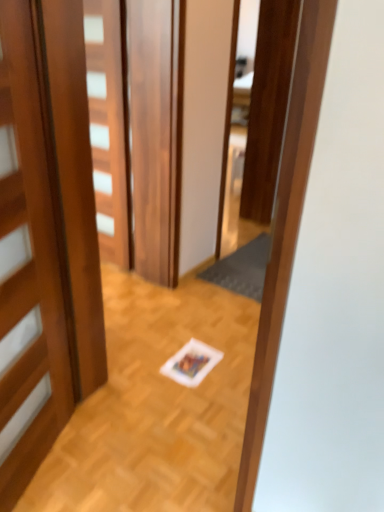
Question: Could wooden door at center, which appears as the first door when viewed from the back, be considered to be inside wooden door at left, which is counted as the 2th door, starting from the back?

Choices:
 (A) yes
 (B) no

Answer: (B)

Question: Is wooden door at left, arranged as the 1th door when viewed from the front, shorter than wooden door at center, which appears as the first door when viewed from the back?

Choices:
 (A) yes
 (B) no

Answer: (A)

Question: Is wooden door at left, arranged as the 1th door when viewed from the front, next to wooden door at center, which is counted as the 2th door, starting from the front, and touching it?

Choices:
 (A) yes
 (B) no

Answer: (B)

Question: From a real-world perspective, is wooden door at left, arranged as the 1th door when viewed from the front, over wooden door at center, which appears as the first door when viewed from the back?

Choices:
 (A) no
 (B) yes

Answer: (A)

Question: Is wooden door at left, which is counted as the 2th door, starting from the back, to the right of wooden door at center, which appears as the first door when viewed from the back, from the viewer's perspective?

Choices:
 (A) yes
 (B) no

Answer: (B)

Question: Can you confirm if wooden door at left, arranged as the 1th door when viewed from the front, is bigger than wooden door at center, which appears as the first door when viewed from the back?

Choices:
 (A) no
 (B) yes

Answer: (B)

Question: From a real-world perspective, is wooden door at center, which is counted as the 2th door, starting from the front, located higher than wooden door at left, which is counted as the 2th door, starting from the back?

Choices:
 (A) no
 (B) yes

Answer: (B)

Question: Is wooden door at center, which appears as the first door when viewed from the back, oriented away from wooden door at left, arranged as the 1th door when viewed from the front?

Choices:
 (A) yes
 (B) no

Answer: (B)

Question: Is wooden door at center, which appears as the first door when viewed from the back, facing towards wooden door at left, arranged as the 1th door when viewed from the front?

Choices:
 (A) no
 (B) yes

Answer: (A)

Question: Is wooden door at center, which appears as the first door when viewed from the back, at the left side of wooden door at left, arranged as the 1th door when viewed from the front?

Choices:
 (A) no
 (B) yes

Answer: (A)

Question: Can you confirm if wooden door at center, which is counted as the 2th door, starting from the front, is shorter than wooden door at left, arranged as the 1th door when viewed from the front?

Choices:
 (A) yes
 (B) no

Answer: (B)

Question: Considering the relative sizes of wooden door at center, which is counted as the 2th door, starting from the front, and wooden door at left, arranged as the 1th door when viewed from the front, in the image provided, is wooden door at center, which is counted as the 2th door, starting from the front, bigger than wooden door at left, arranged as the 1th door when viewed from the front,?

Choices:
 (A) yes
 (B) no

Answer: (B)

Question: Is the surface of dark gray textured mat at center in direct contact with wooden door at left, arranged as the 1th door when viewed from the front?

Choices:
 (A) no
 (B) yes

Answer: (A)